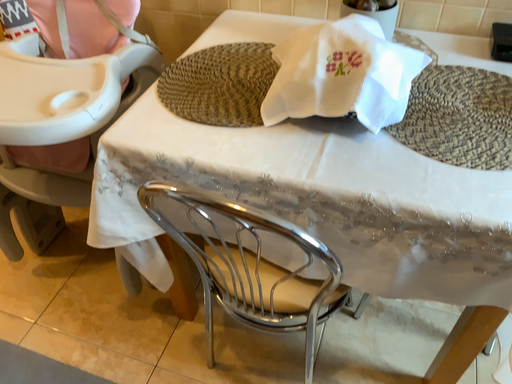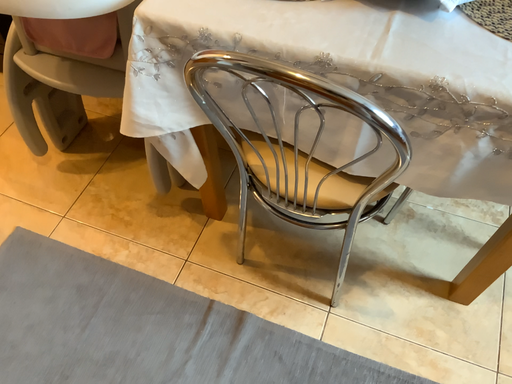
Question: How did the camera likely rotate when shooting the video?

Choices:
 (A) rotated downward
 (B) rotated upward

Answer: (A)